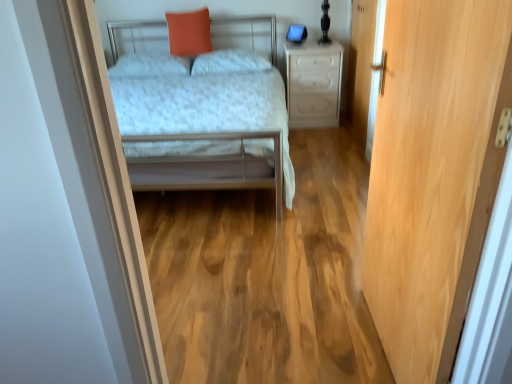
Identify the location of unoccupied area behind light wood door at right. This screenshot has height=384, width=512. (324, 279).